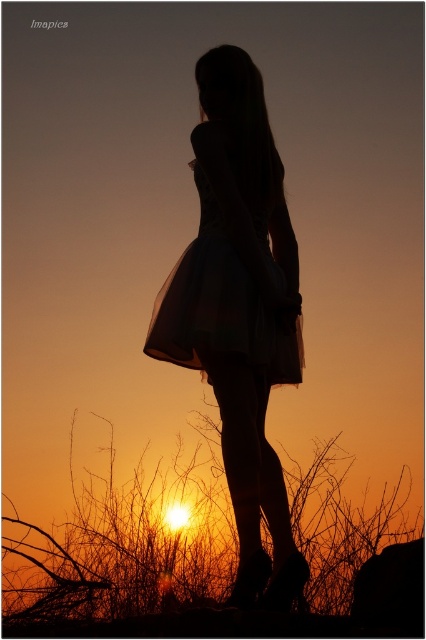
In the scene shown: Does silhouette dress at center appear on the right side of translucent tulle dress at center?

Yes, silhouette dress at center is to the right of translucent tulle dress at center.

This screenshot has width=426, height=640. Describe the element at coordinates (239, 310) in the screenshot. I see `silhouette dress at center` at that location.

Image resolution: width=426 pixels, height=640 pixels. I want to click on silhouette dress at center, so click(239, 310).